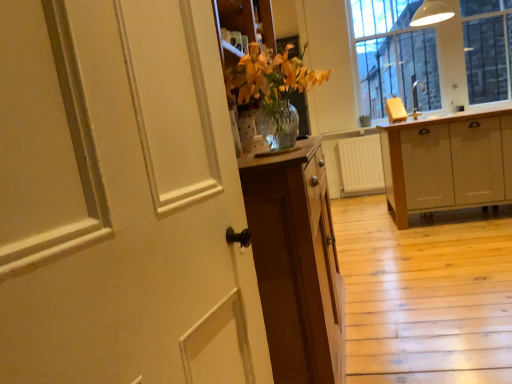
Question: From a real-world perspective, is light wood cabinet at right on top of clear glass window at upper right?

Choices:
 (A) yes
 (B) no

Answer: (B)

Question: From the image's perspective, does light wood cabinet at right appear higher than clear glass window at upper right?

Choices:
 (A) no
 (B) yes

Answer: (A)

Question: From a real-world perspective, does light wood cabinet at right sit lower than clear glass window at upper right?

Choices:
 (A) yes
 (B) no

Answer: (A)

Question: Would you consider light wood cabinet at right to be distant from clear glass window at upper right?

Choices:
 (A) yes
 (B) no

Answer: (B)

Question: Is light wood cabinet at right positioned beyond the bounds of clear glass window at upper right?

Choices:
 (A) no
 (B) yes

Answer: (B)

Question: Is light wood cabinet at right spatially inside white painted wood door at left, or outside of it?

Choices:
 (A) outside
 (B) inside

Answer: (A)

Question: Looking at the image, does light wood cabinet at right seem bigger or smaller compared to white painted wood door at left?

Choices:
 (A) big
 (B) small

Answer: (A)

Question: In the image, is light wood cabinet at right positioned in front of or behind white painted wood door at left?

Choices:
 (A) behind
 (B) front

Answer: (A)

Question: From their relative heights in the image, would you say light wood cabinet at right is taller or shorter than white painted wood door at left?

Choices:
 (A) short
 (B) tall

Answer: (A)

Question: From a real-world perspective, is clear glass window at upper right positioned above or below white painted wood door at left?

Choices:
 (A) above
 (B) below

Answer: (A)

Question: From the image's perspective, is clear glass window at upper right positioned above or below white painted wood door at left?

Choices:
 (A) above
 (B) below

Answer: (A)

Question: Considering the relative positions of clear glass window at upper right and white painted wood door at left in the image provided, is clear glass window at upper right to the left or to the right of white painted wood door at left?

Choices:
 (A) right
 (B) left

Answer: (A)

Question: Is point (404, 21) closer or farther from the camera than point (59, 72)?

Choices:
 (A) closer
 (B) farther

Answer: (B)

Question: Is point (457, 96) positioned closer to the camera than point (420, 87)?

Choices:
 (A) farther
 (B) closer

Answer: (B)

Question: From a real-world perspective, relative to matte silver faucet at upper right, is clear glass window at upper right vertically above or below?

Choices:
 (A) above
 (B) below

Answer: (A)